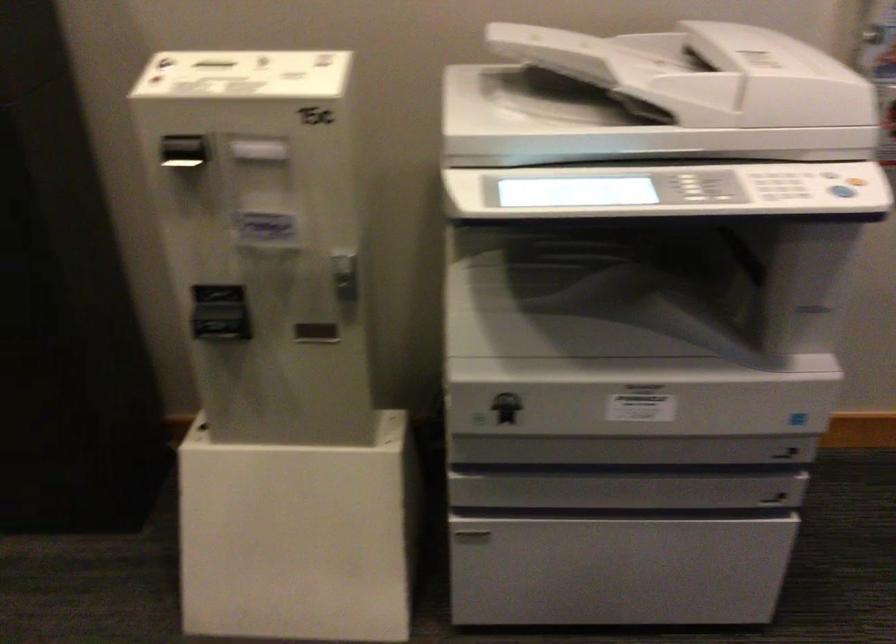
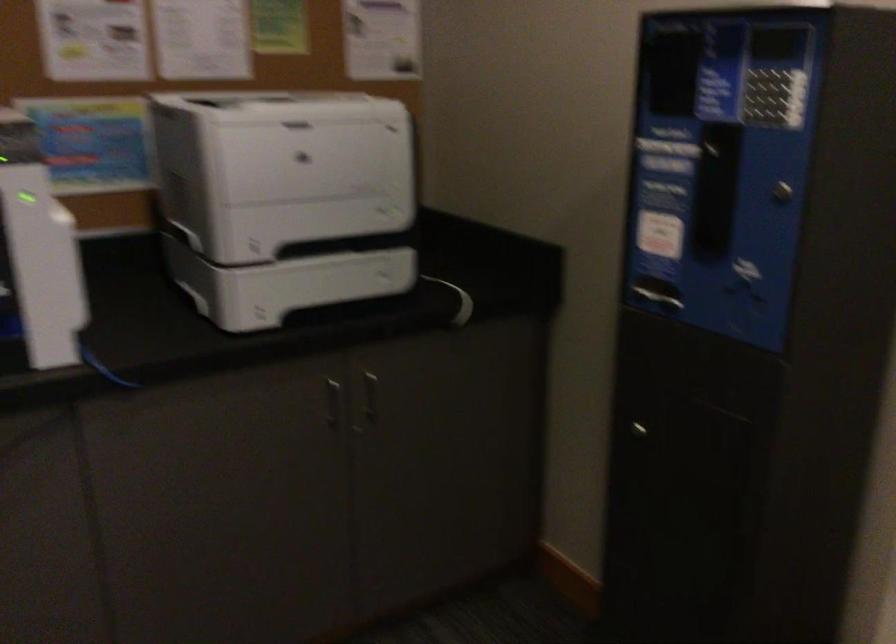
Question: The first image is from the beginning of the video and the second image is from the end. How did the camera likely rotate when shooting the video?

Choices:
 (A) Left
 (B) Right
 (C) Up
 (D) Down

Answer: (A)